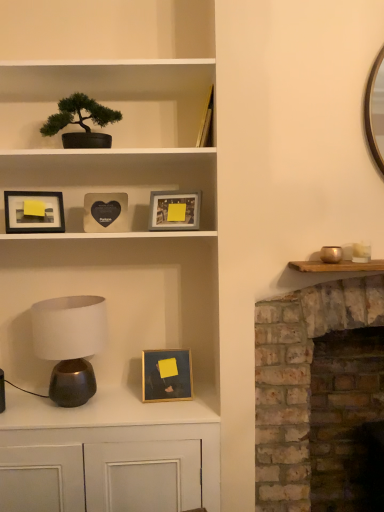
Find the location of a particular element. free space to the left of gold/glossy picture frame at center, the 1th picture frame positioned from the bottom is located at coordinates (120, 403).